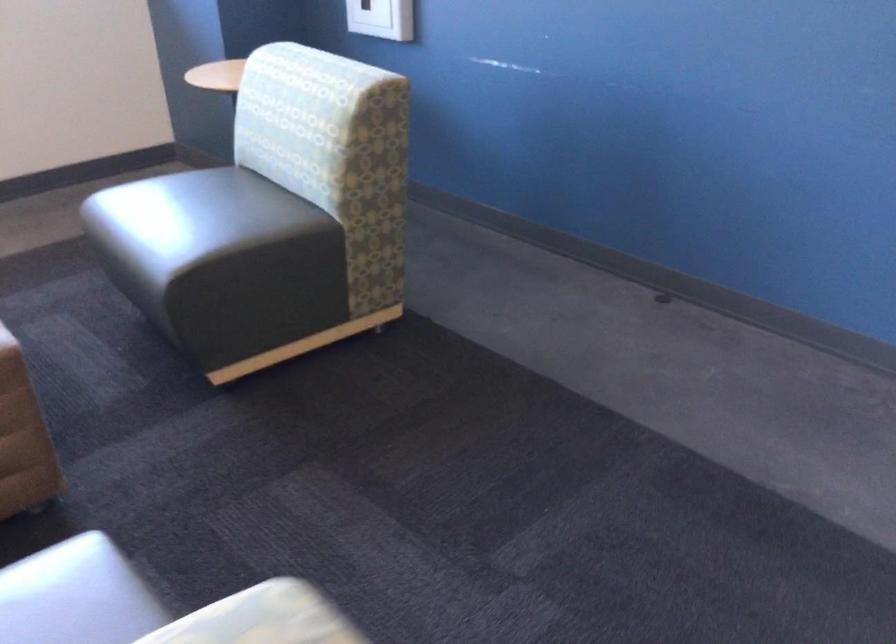
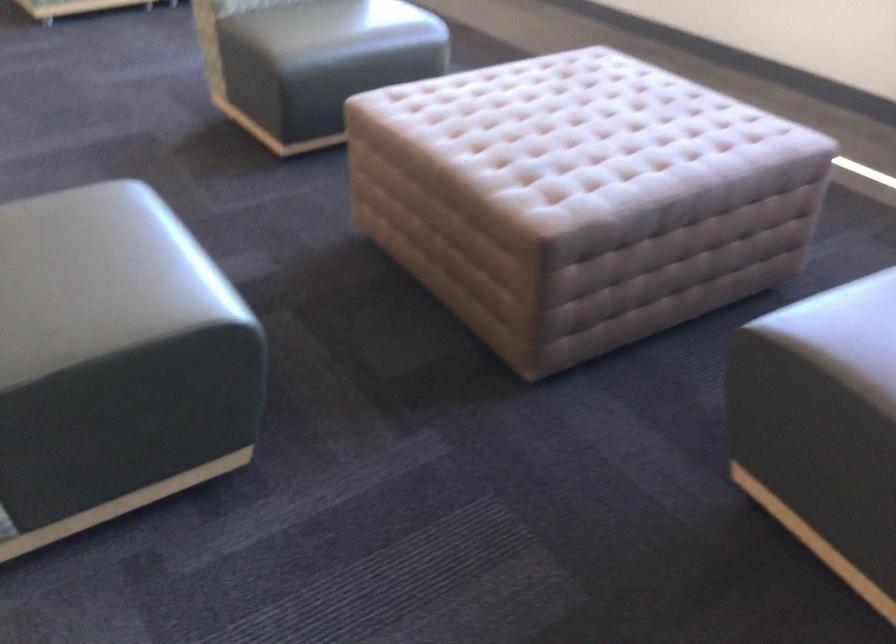
Find the pixel in the second image that matches (x=211, y=241) in the first image.

(846, 335)